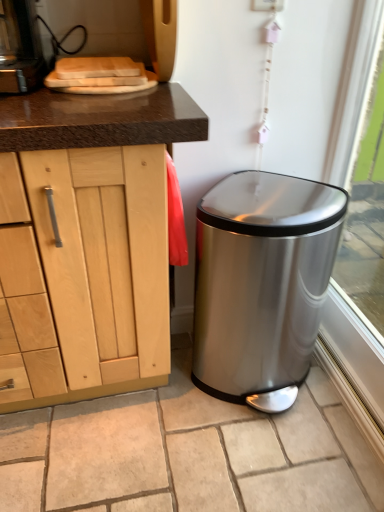
The image size is (384, 512). I want to click on free space in front of polished stainless steel trash can at lower right, so click(266, 459).